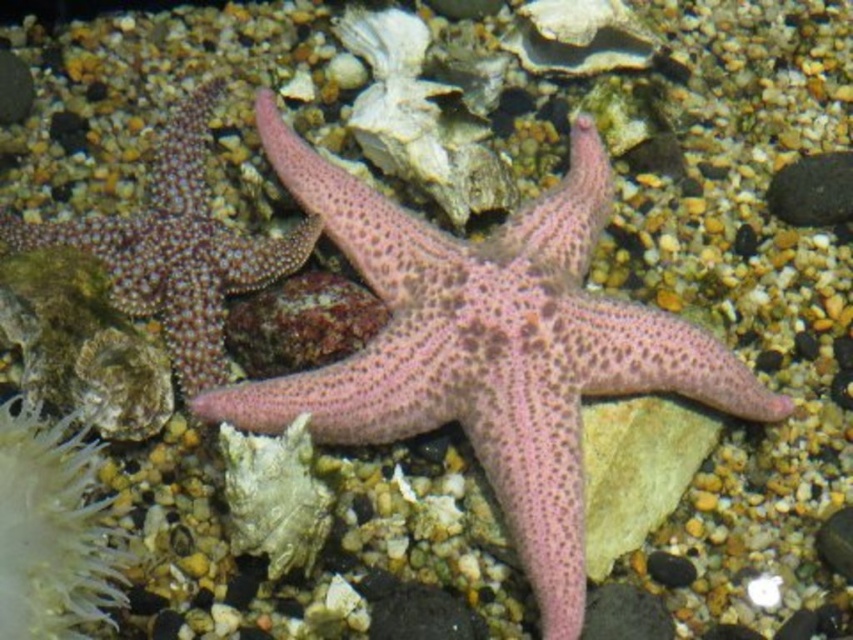
Question: Is spongy pink starfish at center wider than black smooth rock at right?

Choices:
 (A) yes
 (B) no

Answer: (A)

Question: Estimate the real-world distances between objects in this image. Which object is farther from the pink spiny starfish at left?

Choices:
 (A) pink spiny starfish at center
 (B) black smooth rock at right
 (C) translucent gelatinous at lower left
 (D) spongy pink starfish at center

Answer: (B)

Question: Among these points, which one is nearest to the camera?

Choices:
 (A) (27, 540)
 (B) (178, 141)
 (C) (480, 369)

Answer: (A)

Question: Which object is closer to the camera taking this photo?

Choices:
 (A) pink spiny starfish at center
 (B) black smooth rock at right
 (C) spongy pink starfish at center

Answer: (C)

Question: Does pink spiny starfish at left come behind translucent gelatinous at lower left?

Choices:
 (A) yes
 (B) no

Answer: (A)

Question: Where is pink spiny starfish at left located in relation to translucent gelatinous at lower left in the image?

Choices:
 (A) above
 (B) below

Answer: (A)